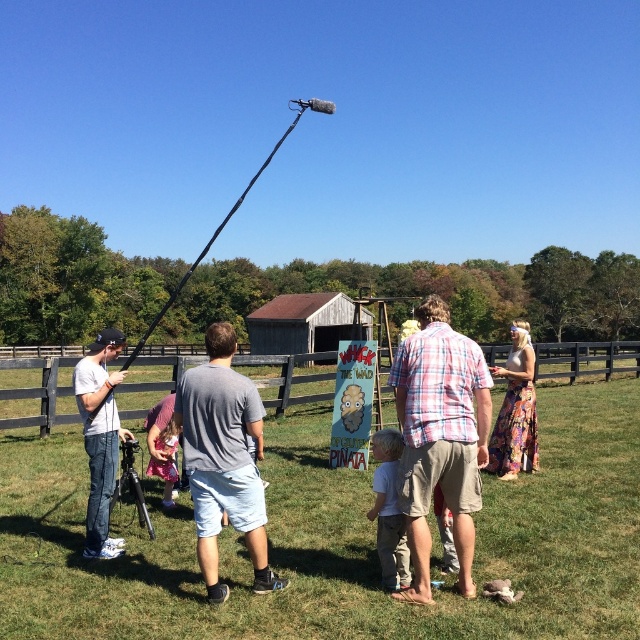
You are planning to set up a camera tripod between the brown wooden fence at center and the pink fabric dress at lower center. Based on their widths, can you determine which side of the path between them you should place the tripod to ensure it doesn not hit either object?

The brown wooden fence at center might be wider than pink fabric dress at lower center, so you should place the tripod closer to the pink fabric dress at lower center to avoid hitting the wider brown wooden fence at center.

You are a photographer standing behind the filming setup. You need to capture a photo of both the light gray cotton shirt at center and the pink fabric dress at lower center. Which of the two clothing items should you focus on first if you want to ensure both are in sharp focus?

You should focus on the light gray cotton shirt at center first because it has a lesser width compared to the pink fabric dress at lower center, so adjusting focus starting from the narrower object ensures depth of field covers both.